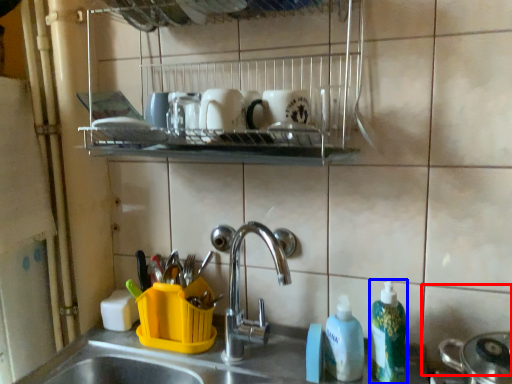
Question: Which object is further to the camera taking this photo, tile (highlighted by a red box) or cleaning product (highlighted by a blue box)?

Choices:
 (A) tile
 (B) cleaning product

Answer: (B)